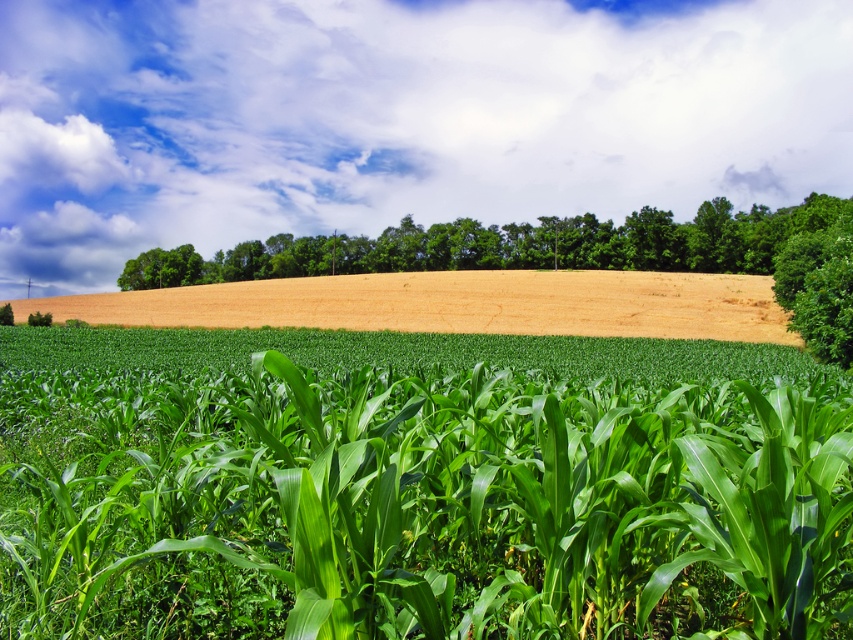
Question: Which is nearer to the green leafy trees at upper center?

Choices:
 (A) white fluffy cloud at upper center
 (B) golden dry wheat field at center
 (C) green leafy corn at center

Answer: (B)

Question: Does golden dry wheat field at center come in front of green leafy trees at upper center?

Choices:
 (A) yes
 (B) no

Answer: (B)

Question: Does white fluffy cloud at upper center have a lesser width compared to green leafy trees at upper center?

Choices:
 (A) yes
 (B) no

Answer: (B)

Question: Which point is closer to the camera taking this photo?

Choices:
 (A) (309, 252)
 (B) (254, 99)

Answer: (A)

Question: Among these objects, which one is nearest to the camera?

Choices:
 (A) green leafy corn at center
 (B) green leafy trees at upper center
 (C) golden dry wheat field at center

Answer: (A)

Question: Observing the image, what is the correct spatial positioning of green leafy corn at center in reference to golden dry wheat field at center?

Choices:
 (A) above
 (B) below

Answer: (B)